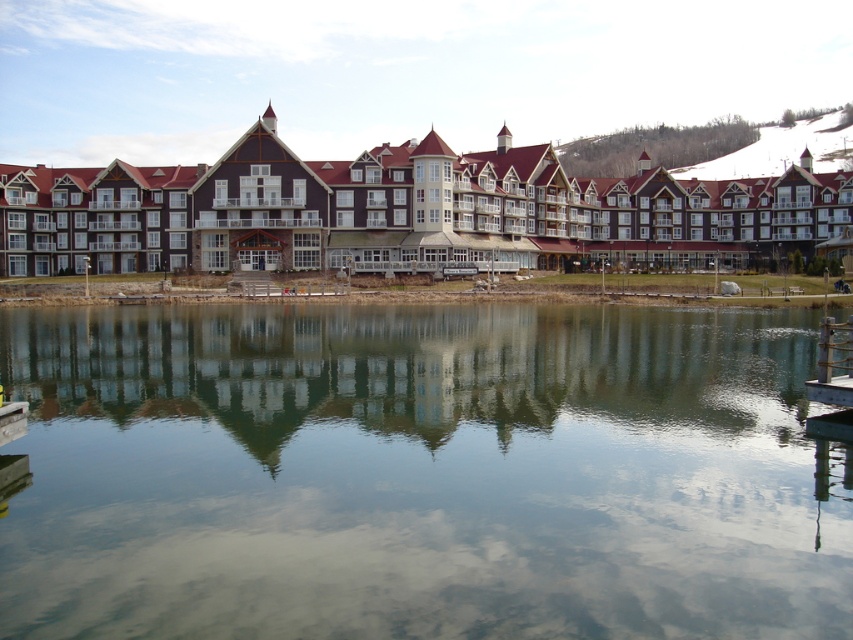
Question: Which of the following is the farthest from the observer?

Choices:
 (A) clear glass water at center
 (B) brown wooden resort at center
 (C) wooden dock at lower right

Answer: (B)

Question: Does clear glass water at center appear over wooden dock at lower right?

Choices:
 (A) no
 (B) yes

Answer: (A)

Question: Which is farther from the brown wooden resort at center?

Choices:
 (A) clear glass water at center
 (B) wooden dock at lower right

Answer: (B)

Question: Can you confirm if clear glass water at center is thinner than wooden dock at lower right?

Choices:
 (A) no
 (B) yes

Answer: (A)

Question: Observing the image, what is the correct spatial positioning of clear glass water at center in reference to wooden dock at lower right?

Choices:
 (A) right
 (B) left

Answer: (B)

Question: Which object is the farthest from the brown wooden resort at center?

Choices:
 (A) clear glass water at center
 (B) wooden dock at lower right

Answer: (B)